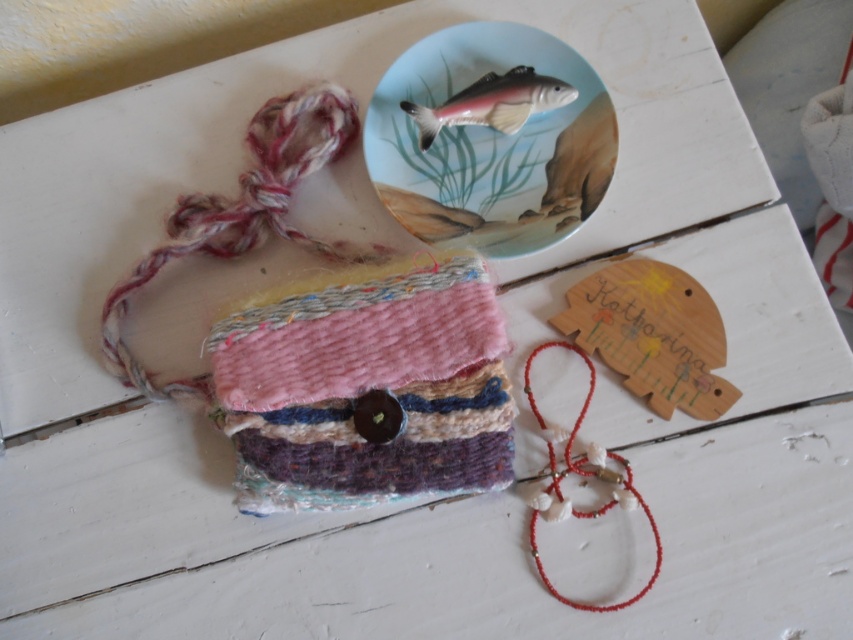
You are an artist arranging items on a rustic wooden surface. You have a textured wool pouch at center and a shiny metallic fish at upper center. Which object is located to the left of the other?

The textured wool pouch at center is positioned on the left side of the shiny metallic fish at upper center.

You are an artisan preparing to package two items. You have a textured wool pouch at center and a red beaded string at lower right. Based on their sizes, which item requires a larger storage container?

The textured wool pouch at center requires a larger storage container because its width is greater than the red beaded string at lower right.

You are looking at the handmade items on the white wooden surface. There are two points marked in the scene. Which point is closer to you, point [485,314] or point [579,515]?

Point [485,314] is in front of point 0.806, 0.806, so it is closer to you.